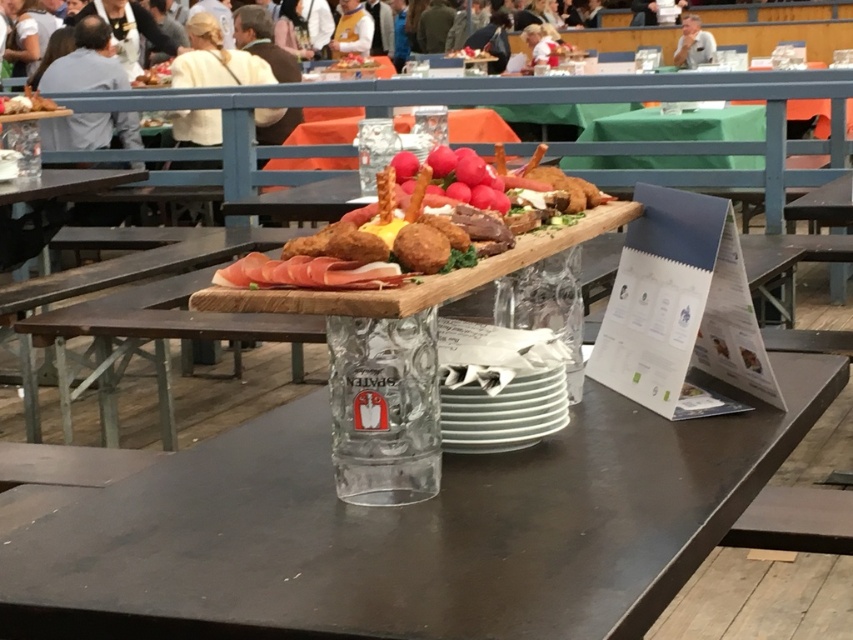
Question: Which object appears closest to the camera in this image?

Choices:
 (A) transparent glass at center
 (B) golden fried croquettes at center

Answer: (A)

Question: Which point is farther from the camera taking this photo?

Choices:
 (A) (235, 218)
 (B) (556, 588)

Answer: (A)

Question: Can you confirm if transparent glass at center is positioned to the left of golden fried croquettes at center?

Choices:
 (A) yes
 (B) no

Answer: (B)

Question: Can you confirm if transparent glass at center is positioned to the left of golden fried croquettes at center?

Choices:
 (A) yes
 (B) no

Answer: (B)

Question: Does transparent glass at center have a smaller size compared to golden fried croquettes at center?

Choices:
 (A) no
 (B) yes

Answer: (A)